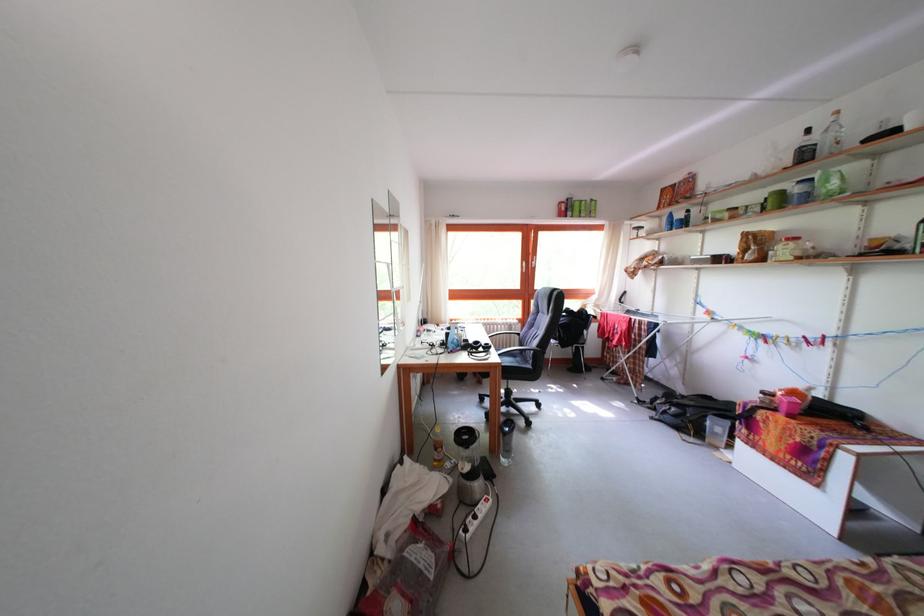
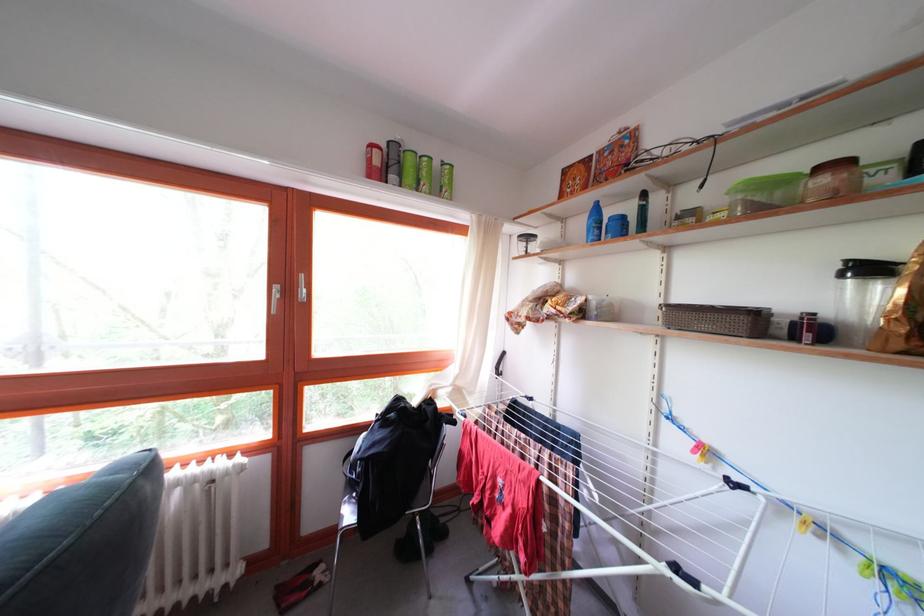
Find the pixel in the second image that matches point (580, 217) in the first image.

(409, 180)